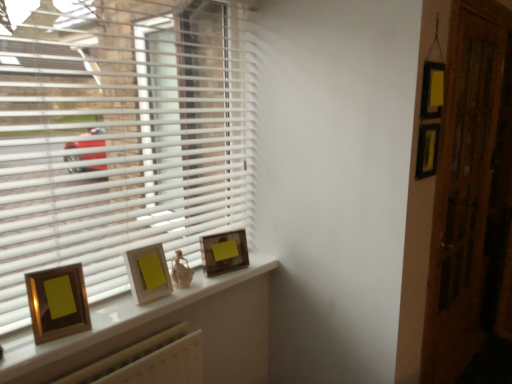
Question: Is gold-framed picture at center taller than matte gold picture frame at center, the third picture frame positioned from the front?

Choices:
 (A) no
 (B) yes

Answer: (A)

Question: From a real-world perspective, is gold-framed picture at center located higher than matte gold picture frame at center, the first picture frame from the back?

Choices:
 (A) no
 (B) yes

Answer: (A)

Question: From a real-world perspective, is gold-framed picture at center located beneath matte gold picture frame at center, the third picture frame positioned from the front?

Choices:
 (A) no
 (B) yes

Answer: (B)

Question: Is gold-framed picture at center far away from matte gold picture frame at center, the first picture frame from the back?

Choices:
 (A) no
 (B) yes

Answer: (A)

Question: Is gold-framed picture at center to the left of matte gold picture frame at center, placed as the 3th picture frame when sorted from left to right, from the viewer's perspective?

Choices:
 (A) yes
 (B) no

Answer: (A)

Question: In the image, is matte gold picture frame at center, the first picture frame from the back, on the left side or the right side of gold-framed picture at center?

Choices:
 (A) left
 (B) right

Answer: (B)

Question: From their relative heights in the image, would you say matte gold picture frame at center, which is the 1th picture frame in right-to-left order, is taller or shorter than gold-framed picture at center?

Choices:
 (A) short
 (B) tall

Answer: (B)

Question: From a real-world perspective, relative to gold-framed picture at center, is matte gold picture frame at center, which is the 1th picture frame in right-to-left order, vertically above or below?

Choices:
 (A) above
 (B) below

Answer: (A)

Question: Is point (227, 253) positioned closer to the camera than point (257, 362)?

Choices:
 (A) farther
 (B) closer

Answer: (B)

Question: From a real-world perspective, is gold-framed picture at center positioned above or below white plastic blinds at left?

Choices:
 (A) above
 (B) below

Answer: (B)

Question: In the image, is gold-framed picture at center on the left side or the right side of white plastic blinds at left?

Choices:
 (A) left
 (B) right

Answer: (B)

Question: Choose the correct answer: Is gold-framed picture at center inside white plastic blinds at left or outside it?

Choices:
 (A) inside
 (B) outside

Answer: (B)

Question: From the image's perspective, relative to white plastic blinds at left, is gold-framed picture at center above or below?

Choices:
 (A) above
 (B) below

Answer: (B)

Question: Looking at their shapes, would you say matte gold picture frame at center, marked as the 2th picture frame in a left-to-right arrangement, is wider or thinner than matte gold picture frame at center, which is the 1th picture frame in right-to-left order?

Choices:
 (A) thin
 (B) wide

Answer: (B)

Question: In terms of height, does matte gold picture frame at center, marked as the 2th picture frame in a left-to-right arrangement, look taller or shorter compared to matte gold picture frame at center, placed as the 3th picture frame when sorted from left to right?

Choices:
 (A) tall
 (B) short

Answer: (A)